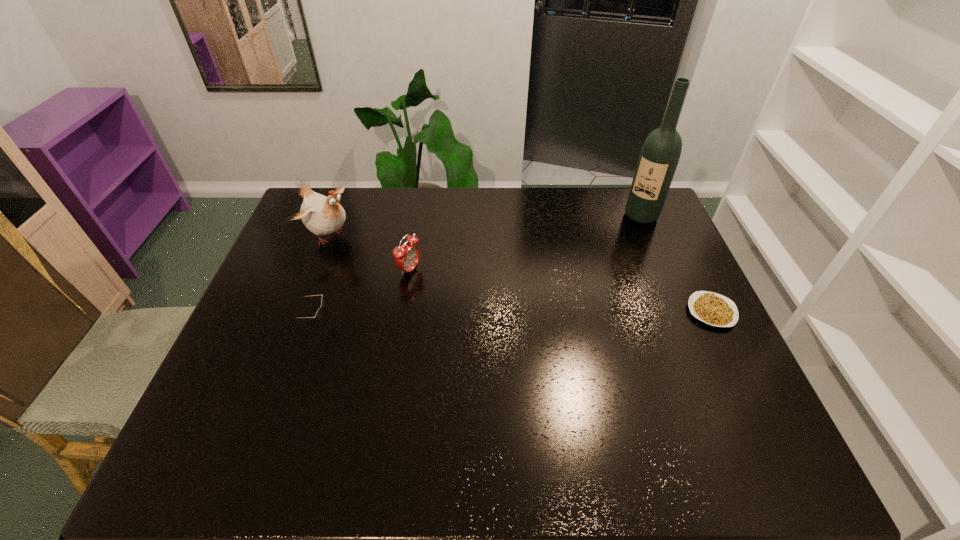
Locate an element on the screen. free spot on the desktop that is between the sunglasses and the legume and is positioned on the labeled side of the wine bottle is located at coordinates (565, 316).

Locate an element on the screen. free spot on the desktop that is between the sunglasses and the shortest object and is positioned on the face of the third nearest object is located at coordinates click(x=516, y=318).

Locate an element on the screen. The image size is (960, 540). free spot on the desktop that is between the sunglasses and the legume and is positioned at the beak of the bird is located at coordinates (496, 318).